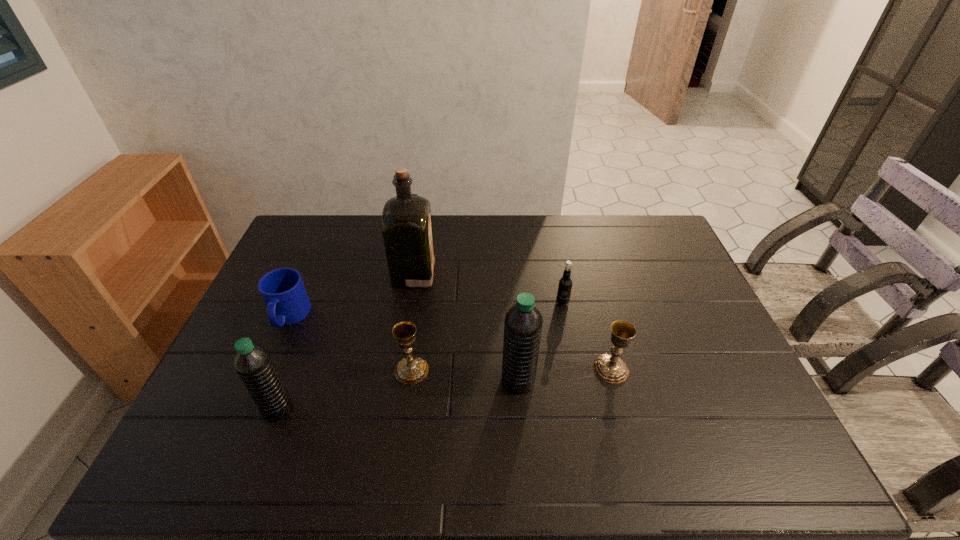
At what (x,y) coordinates should I click in order to perform the action: click on empty space between the farther water bottle and the rightmost object. Please return your answer as a coordinate pair (x, y). Image resolution: width=960 pixels, height=540 pixels. Looking at the image, I should click on (564, 375).

Find the location of `free spot between the root beer and the nearer water bottle`. free spot between the root beer and the nearer water bottle is located at coordinates (420, 356).

This screenshot has width=960, height=540. Find the location of `empty location between the sixth shortest object and the right chalice`. empty location between the sixth shortest object and the right chalice is located at coordinates (564, 375).

I want to click on free space between the shortest object and the third tallest object, so click(x=283, y=363).

At what (x,y) coordinates should I click in order to perform the action: click on free spot between the rightmost object and the mug. Please return your answer as a coordinate pair (x, y). Looking at the image, I should click on (450, 343).

At what (x,y) coordinates should I click in order to perform the action: click on free space between the shortest object and the farthest object. Please return your answer as a coordinate pair (x, y). The image size is (960, 540). Looking at the image, I should click on (351, 295).

Point out which object is positioned as the fourth nearest to the root beer. Please provide its 2D coordinates. Your answer should be formatted as a tuple, i.e. [(x, y)], where the tuple contains the x and y coordinates of a point satisfying the conditions above.

[(411, 370)]

This screenshot has width=960, height=540. I want to click on the second closest object to the nearest object, so click(411, 370).

Locate an element on the screen. This screenshot has width=960, height=540. free location that satisfies the following two spatial constraints: 1. on the back side of the left chalice; 2. on the right side of the shorter water bottle is located at coordinates (292, 370).

I want to click on vacant space that satisfies the following two spatial constraints: 1. on the label of the right chalice; 2. on the right side of the root beer, so click(x=575, y=369).